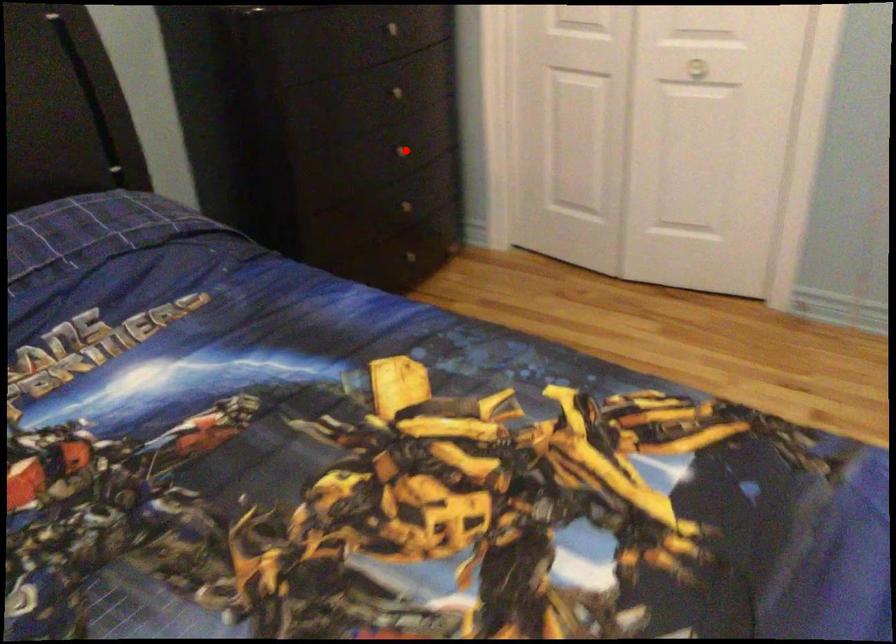
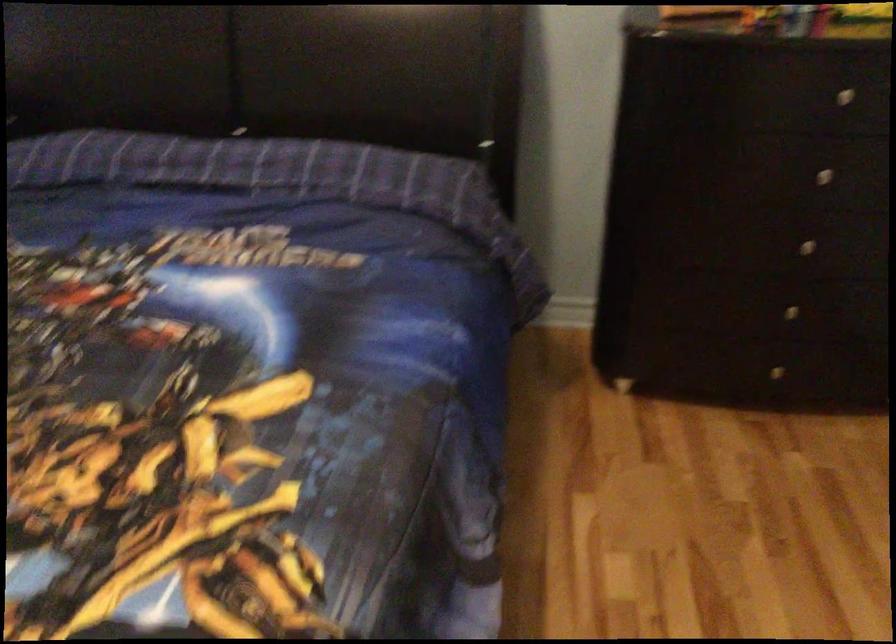
Question: I am providing you with two images of the same scene from different viewpoints. In image1, a red point is highlighted. Considering the same 3D point in image2, which of the following is correct?

Choices:
 (A) It is closer
 (B) It is farther

Answer: (A)